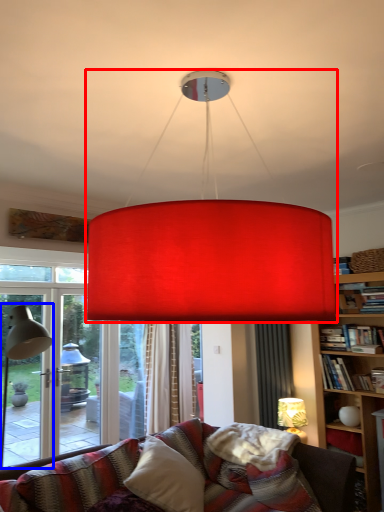
Question: Which point is further to the camera, lamp (highlighted by a red box) or table lamp (highlighted by a blue box)?

Choices:
 (A) lamp
 (B) table lamp

Answer: (B)